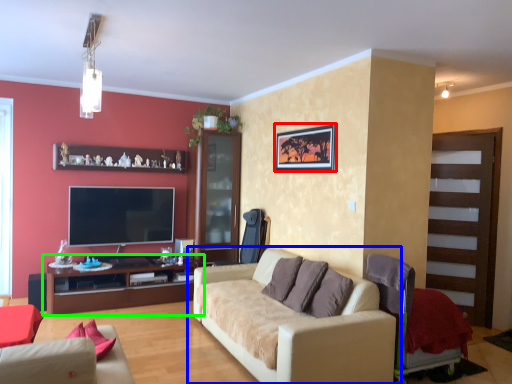
Question: Which object is the farthest from picture frame (highlighted by a red box)? Choose among these: studio couch (highlighted by a blue box) or cabinetry (highlighted by a green box).

Choices:
 (A) studio couch
 (B) cabinetry

Answer: (B)